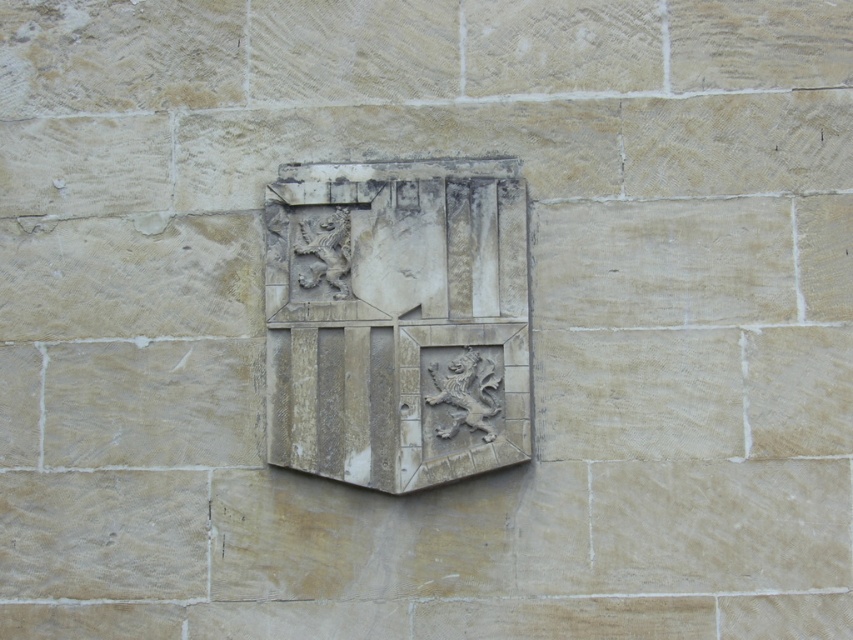
You are an architect examining the stone wall and need to locate the stone relief emblem at center. According to the coordinates provided, where exactly is the stone relief emblem positioned on the wall?

The stone relief emblem at center is located at point coordinates of 0.502 on the horizontal axis and 0.467 on the vertical axis.

You are an architect examining the stone wall and notice two carvings. The first is the stone relief emblem at center, and the second is the carved stone lion at center. Based on their sizes, which one do you think would require more material to create?

The stone relief emblem at center requires more material because its width is larger than the carved stone lion at center.

You are an architect examining the stone wall. You notice the stone relief emblem at center and the carved stone lion at center. Which object is located higher up on the wall?

The stone relief emblem at center is positioned over the carved stone lion at center, meaning it is higher up on the wall.